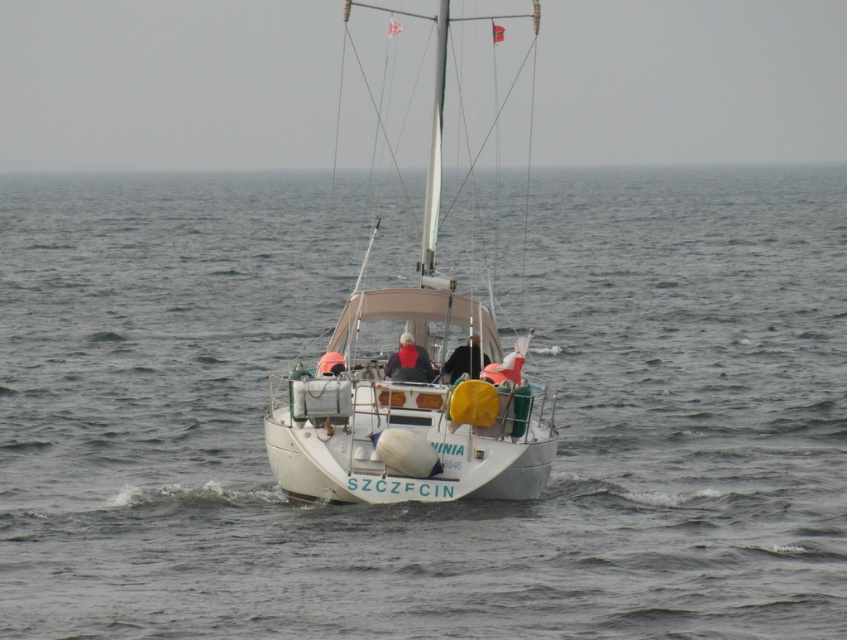
Consider the image. Can you confirm if white matte sailboat at center is shorter than dark blue fabric jacket at center?

No, white matte sailboat at center is not shorter than dark blue fabric jacket at center.

What are the coordinates of `white matte sailboat at center` in the screenshot? It's located at (411, 390).

You are a GUI agent. You are given a task and a screenshot of the screen. Output one action in this format:
    pyautogui.click(x=<x>, y=<y>)
    Task: Click on the white matte sailboat at center
    
    Given the screenshot: What is the action you would take?
    pyautogui.click(x=411, y=390)

Does gray water at center have a greater height compared to white matte sailboat at center?

In fact, gray water at center may be shorter than white matte sailboat at center.

Between gray water at center and white matte sailboat at center, which one is positioned higher?

Positioned higher is white matte sailboat at center.

Between point (591, 579) and point (460, 468), which one is positioned behind?

Point (460, 468)

At what (x,y) coordinates should I click in order to perform the action: click on gray water at center. Please return your answer as a coordinate pair (x, y). Image resolution: width=847 pixels, height=640 pixels. Looking at the image, I should click on pyautogui.click(x=425, y=504).

Who is positioned more to the left, gray water at center or black fabric jacket at center?

Positioned to the left is gray water at center.

This screenshot has width=847, height=640. Identify the location of gray water at center. (425, 504).

Where is `gray water at center`? Image resolution: width=847 pixels, height=640 pixels. gray water at center is located at coordinates (425, 504).